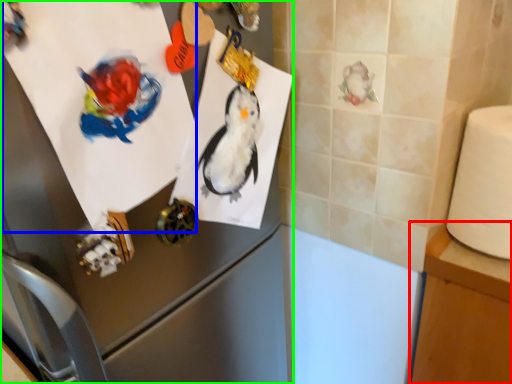
Question: Considering the real-world distances, which object is closest to table (highlighted by a red box)? paper (highlighted by a blue box) or appliance (highlighted by a green box).

Choices:
 (A) paper
 (B) appliance

Answer: (B)